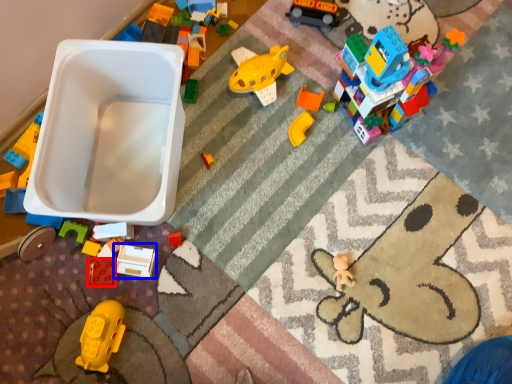
Question: Among these objects, which one is nearest to the camera, toy (highlighted by a red box) or toy (highlighted by a blue box)?

Choices:
 (A) toy
 (B) toy

Answer: (B)